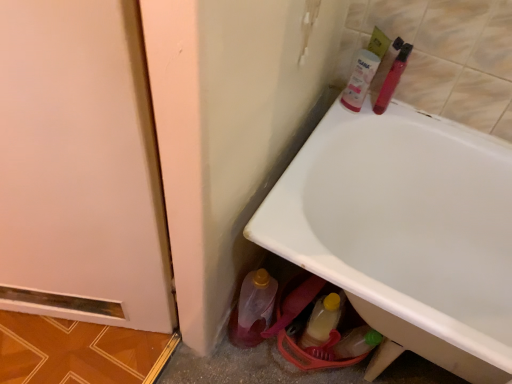
Question: Can you confirm if pink plastic tube at upper right, the 2th mouthwash viewed from the right, is shorter than translucent plastic tube at upper right, which ranks as the first mouthwash in right-to-left order?

Choices:
 (A) no
 (B) yes

Answer: (B)

Question: Does pink plastic tube at upper right, acting as the first mouthwash starting from the left, have a larger size compared to translucent plastic tube at upper right, which is the second mouthwash from left to right?

Choices:
 (A) yes
 (B) no

Answer: (B)

Question: Is pink plastic tube at upper right, acting as the first mouthwash starting from the left, turned away from translucent plastic tube at upper right, which is the second mouthwash from left to right?

Choices:
 (A) no
 (B) yes

Answer: (A)

Question: Can you confirm if pink plastic tube at upper right, acting as the first mouthwash starting from the left, is positioned to the left of translucent plastic tube at upper right, which ranks as the first mouthwash in right-to-left order?

Choices:
 (A) yes
 (B) no

Answer: (A)

Question: From the image's perspective, would you say pink plastic tube at upper right, the 2th mouthwash viewed from the right, is shown under translucent plastic tube at upper right, which is the second mouthwash from left to right?

Choices:
 (A) no
 (B) yes

Answer: (B)

Question: Is point (230, 327) closer or farther from the camera than point (356, 77)?

Choices:
 (A) farther
 (B) closer

Answer: (A)

Question: From the image's perspective, is translucent plastic bottle at lower center, which is counted as the first bottle, starting from the left, located above or below pink plastic tube at upper right, acting as the first mouthwash starting from the left?

Choices:
 (A) below
 (B) above

Answer: (A)

Question: From their relative heights in the image, would you say translucent plastic bottle at lower center, the second bottle viewed from the right, is taller or shorter than pink plastic tube at upper right, the 2th mouthwash viewed from the right?

Choices:
 (A) short
 (B) tall

Answer: (B)

Question: In the image, is translucent plastic bottle at lower center, which is counted as the first bottle, starting from the left, positioned in front of or behind pink plastic tube at upper right, the 2th mouthwash viewed from the right?

Choices:
 (A) front
 (B) behind

Answer: (A)

Question: In the image, is translucent yellow plastic bottle at lower center, which is counted as the first bottle, starting from the right, positioned in front of or behind translucent plastic tube at upper right, which is the second mouthwash from left to right?

Choices:
 (A) front
 (B) behind

Answer: (B)

Question: Which is correct: translucent yellow plastic bottle at lower center, which is counted as the first bottle, starting from the right, is inside translucent plastic tube at upper right, which ranks as the first mouthwash in right-to-left order, or outside of it?

Choices:
 (A) inside
 (B) outside

Answer: (B)

Question: Based on their sizes in the image, would you say translucent yellow plastic bottle at lower center, which is counted as the first bottle, starting from the right, is bigger or smaller than translucent plastic tube at upper right, which ranks as the first mouthwash in right-to-left order?

Choices:
 (A) big
 (B) small

Answer: (A)

Question: Considering the positions of point tap(322, 327) and point tap(406, 46), is point tap(322, 327) closer or farther from the camera than point tap(406, 46)?

Choices:
 (A) closer
 (B) farther

Answer: (B)

Question: From the image's perspective, is white glossy bathtub at lower right located above or below pink plastic tube at upper right, acting as the first mouthwash starting from the left?

Choices:
 (A) below
 (B) above

Answer: (A)

Question: Is white glossy bathtub at lower right bigger or smaller than pink plastic tube at upper right, the 2th mouthwash viewed from the right?

Choices:
 (A) small
 (B) big

Answer: (B)